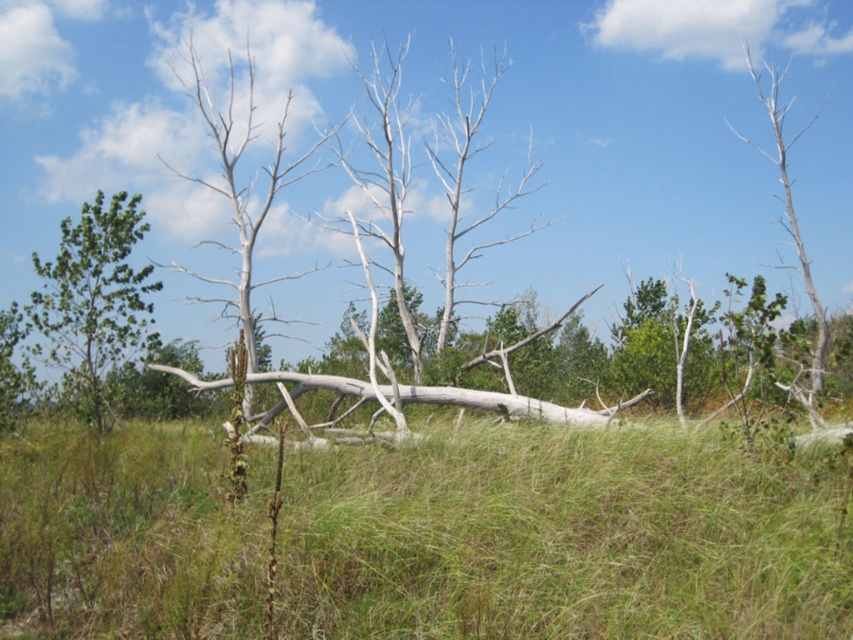
Question: Which point appears farthest from the camera in this image?

Choices:
 (A) (74, 372)
 (B) (790, 144)

Answer: (B)

Question: Is green grassy at center to the right of gray bark tree at upper right from the viewer's perspective?

Choices:
 (A) no
 (B) yes

Answer: (A)

Question: Is green grassy at center in front of gray bark tree at upper right?

Choices:
 (A) yes
 (B) no

Answer: (A)

Question: Which point is closer to the camera taking this photo?

Choices:
 (A) (102, 372)
 (B) (112, 616)

Answer: (B)

Question: Does green leafy tree at left have a lesser width compared to gray bark tree at upper right?

Choices:
 (A) no
 (B) yes

Answer: (B)

Question: Among these objects, which one is farthest from the camera?

Choices:
 (A) gray bark tree at upper right
 (B) green grassy at center

Answer: (A)